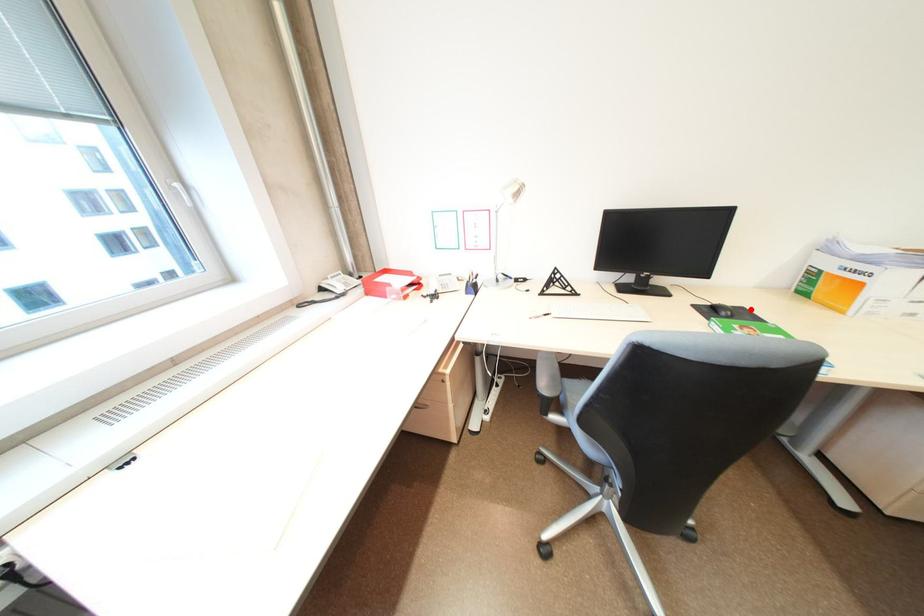
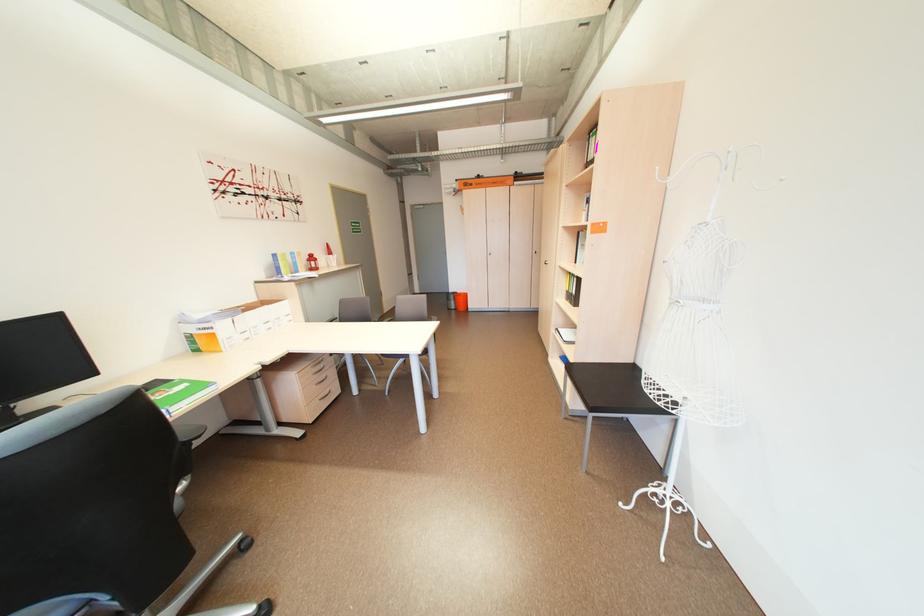
Find the pixel in the second image that matches the highlighted location in the first image.

(164, 382)